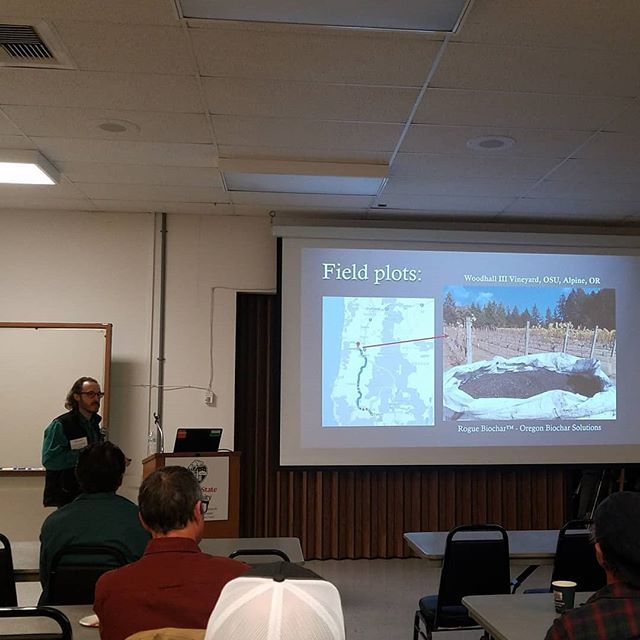
Identify the location of projection screen. This screenshot has width=640, height=640. (297, 452).